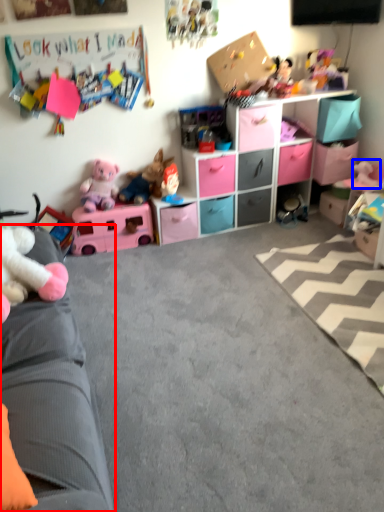
Question: Which object is further to the camera taking this photo, studio couch (highlighted by a red box) or toy (highlighted by a blue box)?

Choices:
 (A) studio couch
 (B) toy

Answer: (B)